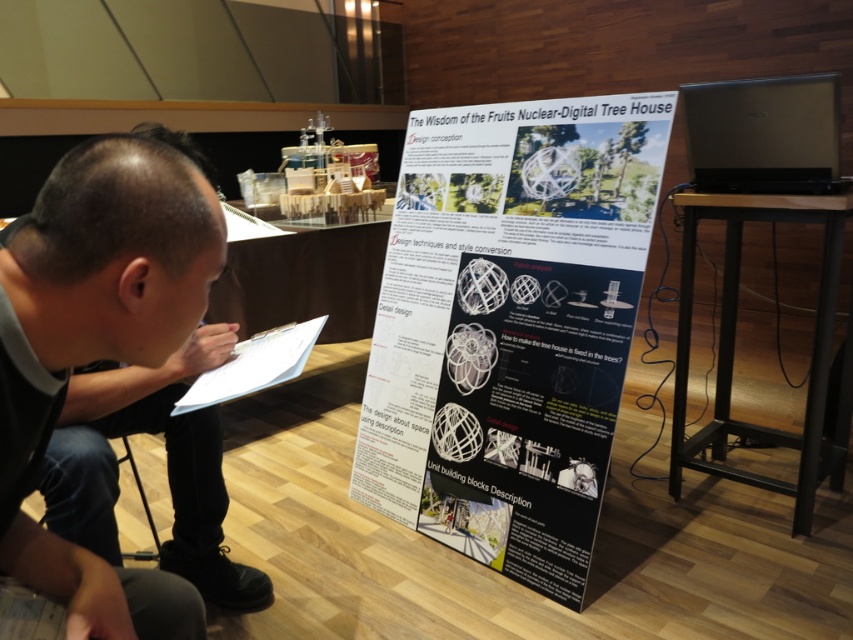
Can you confirm if white paperboard poster at center is shorter than white paper at center?

Incorrect, white paperboard poster at center's height does not fall short of white paper at center's.

Looking at this image, can you confirm if white paperboard poster at center is positioned to the left of white paper at center?

No, white paperboard poster at center is not to the left of white paper at center.

Between point (433, 413) and point (299, 323), which one is positioned behind?

The point (433, 413) is behind.

This screenshot has width=853, height=640. What are the coordinates of `white paperboard poster at center` in the screenshot? It's located at (509, 326).

Is black fabric pants at lower left taller than silver metallic laptop at upper right?

Indeed, black fabric pants at lower left has a greater height compared to silver metallic laptop at upper right.

How distant is black fabric pants at lower left from silver metallic laptop at upper right?

The distance of black fabric pants at lower left from silver metallic laptop at upper right is 5.40 feet.

Measure the distance between point (x=167, y=390) and camera.

1.41 meters

This screenshot has height=640, width=853. What are the coordinates of `black fabric pants at lower left` in the screenshot? It's located at (166, 467).

What do you see at coordinates (509, 326) in the screenshot? I see `white paperboard poster at center` at bounding box center [509, 326].

Looking at this image, can you confirm if white paperboard poster at center is thinner than black fabric pants at lower left?

No.

Find the location of `white paperboard poster at center`. white paperboard poster at center is located at coordinates (509, 326).